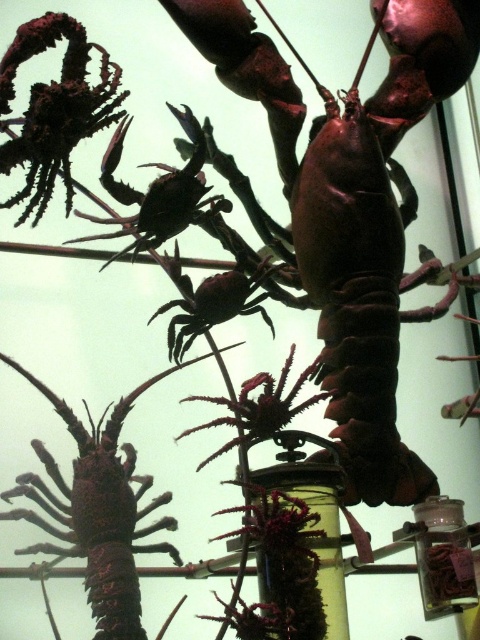
Is brown matte lobster at upper center further to camera compared to shiny brown lobster at center?

Yes, it is.

Does point (337, 211) lie in front of point (55, 476)?

No, it is behind (55, 476).

Locate an element on the screen. brown matte lobster at upper center is located at coordinates (348, 204).